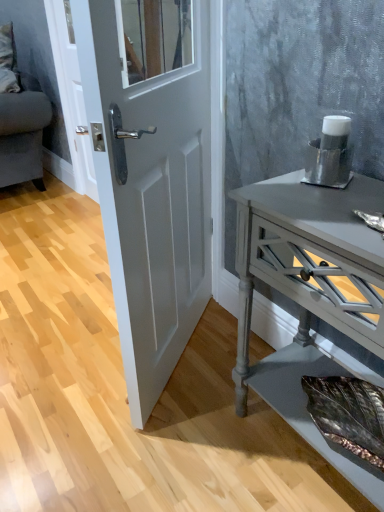
Where is `white glossy door at center`? The width and height of the screenshot is (384, 512). white glossy door at center is located at coordinates (150, 173).

Considering the positions of objects silver metallic cup at right and white glossy door at center in the image provided, who is more to the right, silver metallic cup at right or white glossy door at center?

From the viewer's perspective, silver metallic cup at right appears more on the right side.

Considering the sizes of objects silver metallic cup at right and white glossy door at center in the image provided, who is taller, silver metallic cup at right or white glossy door at center?

Standing taller between the two is white glossy door at center.

How different are the orientations of silver metallic cup at right and white glossy door at center in degrees?

54.5 degrees separate the facing orientations of silver metallic cup at right and white glossy door at center.

Based on the photo, from a real-world perspective, does silver metallic cup at right stand above white glossy door at center?

Yes.

Considering the positions of objects white glossy door at center and matte gray wooden nightstand at right in the image provided, who is behind, white glossy door at center or matte gray wooden nightstand at right?

white glossy door at center is more distant.

Does white glossy door at center have a greater height compared to matte gray wooden nightstand at right?

Yes, white glossy door at center is taller than matte gray wooden nightstand at right.

From the image's perspective, is white glossy door at center under matte gray wooden nightstand at right?

No, from the image's perspective, white glossy door at center is not below matte gray wooden nightstand at right.

Considering the sizes of velvet grey couch at upper left and silver metallic cup at right in the image, is velvet grey couch at upper left wider or thinner than silver metallic cup at right?

velvet grey couch at upper left is wider than silver metallic cup at right.

Is velvet grey couch at upper left taller than silver metallic cup at right?

Correct, velvet grey couch at upper left is much taller as silver metallic cup at right.

The width and height of the screenshot is (384, 512). What are the coordinates of `studio couch behind the silver metallic cup at right` in the screenshot? It's located at (19, 120).

From the image's perspective, which is above, velvet grey couch at upper left or silver metallic cup at right?

velvet grey couch at upper left.

From a real-world perspective, which is physically below, matte gray wooden nightstand at right or silver metallic cup at right?

From a 3D spatial view, matte gray wooden nightstand at right is below.

The width and height of the screenshot is (384, 512). I want to click on nightstand on the right side of silver metallic cup at right, so click(x=310, y=294).

From the image's perspective, which one is positioned higher, matte gray wooden nightstand at right or silver metallic cup at right?

silver metallic cup at right.

Considering the relative sizes of matte gray wooden nightstand at right and silver metallic cup at right in the image provided, is matte gray wooden nightstand at right smaller than silver metallic cup at right?

No, matte gray wooden nightstand at right is not smaller than silver metallic cup at right.

From a real-world perspective, is white glossy door at center physically above silver metallic cup at right?

Incorrect, from a real-world perspective, white glossy door at center is lower than silver metallic cup at right.

How many degrees apart are the facing directions of white glossy door at center and silver metallic cup at right?

There is a 54.5-degree angle between the facing directions of white glossy door at center and silver metallic cup at right.

You are a GUI agent. You are given a task and a screenshot of the screen. Output one action in this format:
    pyautogui.click(x=<x>, y=<y>)
    Task: Click on the appliance above the white glossy door at center (from the image's perspective)
    This screenshot has height=512, width=384.
    Given the screenshot: What is the action you would take?
    pyautogui.click(x=330, y=154)

Does white glossy door at center have a lesser width compared to silver metallic cup at right?

Indeed, white glossy door at center has a lesser width compared to silver metallic cup at right.

Is velvet grey couch at upper left inside or outside of matte gray wooden nightstand at right?

velvet grey couch at upper left lies outside matte gray wooden nightstand at right.

Is there a large distance between velvet grey couch at upper left and matte gray wooden nightstand at right?

Yes, velvet grey couch at upper left and matte gray wooden nightstand at right are quite far apart.

Is point (7, 168) positioned in front of point (319, 226)?

No, (7, 168) is behind (319, 226).

Find the location of a particular element. nightstand below the velvet grey couch at upper left (from a real-world perspective) is located at coordinates (310, 294).

How far apart are matte gray wooden nightstand at right and velvet grey couch at upper left?

matte gray wooden nightstand at right and velvet grey couch at upper left are 7.25 feet apart.

Is matte gray wooden nightstand at right positioned beyond the bounds of velvet grey couch at upper left?

That's correct, matte gray wooden nightstand at right is outside of velvet grey couch at upper left.

From a real-world perspective, who is located lower, matte gray wooden nightstand at right or velvet grey couch at upper left?

matte gray wooden nightstand at right.

Relative to velvet grey couch at upper left, is matte gray wooden nightstand at right in front or behind?

matte gray wooden nightstand at right is positioned closer to the viewer than velvet grey couch at upper left.

In order to click on appliance on the right side of white glossy door at center in this screenshot , I will do `click(330, 154)`.

Where is `door that is on the left side of matte gray wooden nightstand at right`? This screenshot has width=384, height=512. door that is on the left side of matte gray wooden nightstand at right is located at coordinates (150, 173).

From the image, which object appears to be farther from white glossy door at center, matte gray wooden nightstand at right or velvet grey couch at upper left?

velvet grey couch at upper left is positioned further to the anchor white glossy door at center.

Which object lies nearer to the anchor point matte gray wooden nightstand at right, velvet grey couch at upper left or white glossy door at center?

white glossy door at center lies closer to matte gray wooden nightstand at right than the other object.

Estimate the real-world distances between objects in this image. Which object is closer to silver metallic cup at right, velvet grey couch at upper left or matte gray wooden nightstand at right?

matte gray wooden nightstand at right is positioned closer to the anchor silver metallic cup at right.

Considering their positions, is matte gray wooden nightstand at right positioned closer to silver metallic cup at right than white glossy door at center?

matte gray wooden nightstand at right.

Considering their positions, is white glossy door at center positioned further to silver metallic cup at right than velvet grey couch at upper left?

The object further to silver metallic cup at right is velvet grey couch at upper left.

Based on their spatial positions, is velvet grey couch at upper left or matte gray wooden nightstand at right closer to white glossy door at center?

matte gray wooden nightstand at right is closer to white glossy door at center.

From the picture: From the image, which object appears to be nearer to velvet grey couch at upper left, white glossy door at center or matte gray wooden nightstand at right?

white glossy door at center lies closer to velvet grey couch at upper left than the other object.

When comparing their distances from velvet grey couch at upper left, does matte gray wooden nightstand at right or white glossy door at center seem closer?

The object closer to velvet grey couch at upper left is white glossy door at center.

Find the location of `appliance between white glossy door at center and velvet grey couch at upper left along the z-axis`. appliance between white glossy door at center and velvet grey couch at upper left along the z-axis is located at coordinates (330, 154).

Locate an element on the screen. The height and width of the screenshot is (512, 384). appliance between velvet grey couch at upper left and matte gray wooden nightstand at right from left to right is located at coordinates (330, 154).

At what (x,y) coordinates should I click in order to perform the action: click on door between silver metallic cup at right and matte gray wooden nightstand at right from top to bottom. Please return your answer as a coordinate pair (x, y). The image size is (384, 512). Looking at the image, I should click on (150, 173).

Where is `door between matte gray wooden nightstand at right and velvet grey couch at upper left in the front-back direction`? The height and width of the screenshot is (512, 384). door between matte gray wooden nightstand at right and velvet grey couch at upper left in the front-back direction is located at coordinates click(x=150, y=173).